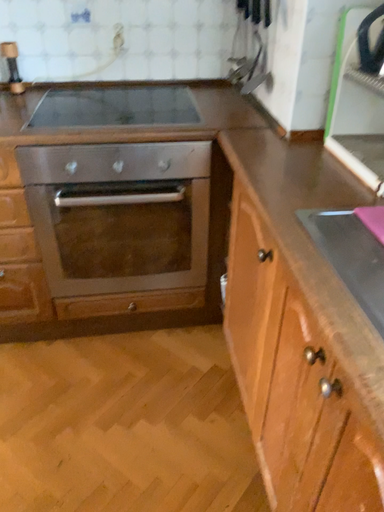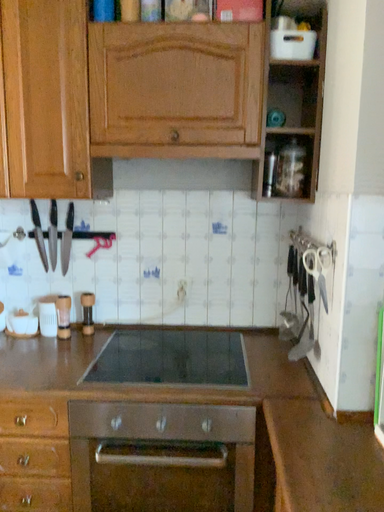
Question: Which way did the camera rotate in the video?

Choices:
 (A) rotated downward
 (B) rotated upward

Answer: (B)